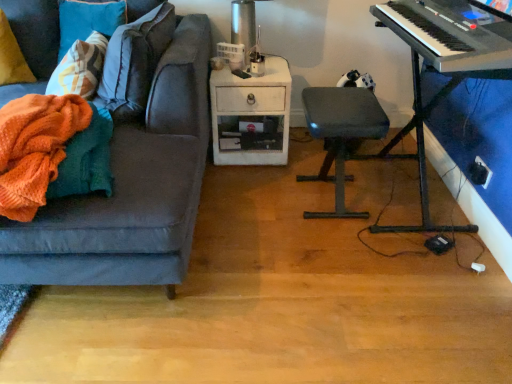
Question: In the image, is metallic silver table lamp at upper center positioned in front of or behind black plastic keyboard at upper right?

Choices:
 (A) front
 (B) behind

Answer: (B)

Question: In terms of width, does metallic silver table lamp at upper center look wider or thinner when compared to black plastic keyboard at upper right?

Choices:
 (A) wide
 (B) thin

Answer: (B)

Question: Which of these objects is positioned closest to the black plastic keyboard at upper right?

Choices:
 (A) matte gray stool at center
 (B) white wicker side table at center
 (C) metallic silver table lamp at upper center
 (D) black plastic keyboard at right
 (E) yellow fabric pillow at left

Answer: (D)

Question: Which object is the closest to the white wicker side table at center?

Choices:
 (A) yellow fabric pillow at left
 (B) black plastic keyboard at upper right
 (C) matte gray stool at center
 (D) black plastic keyboard at right
 (E) metallic silver table lamp at upper center

Answer: (E)